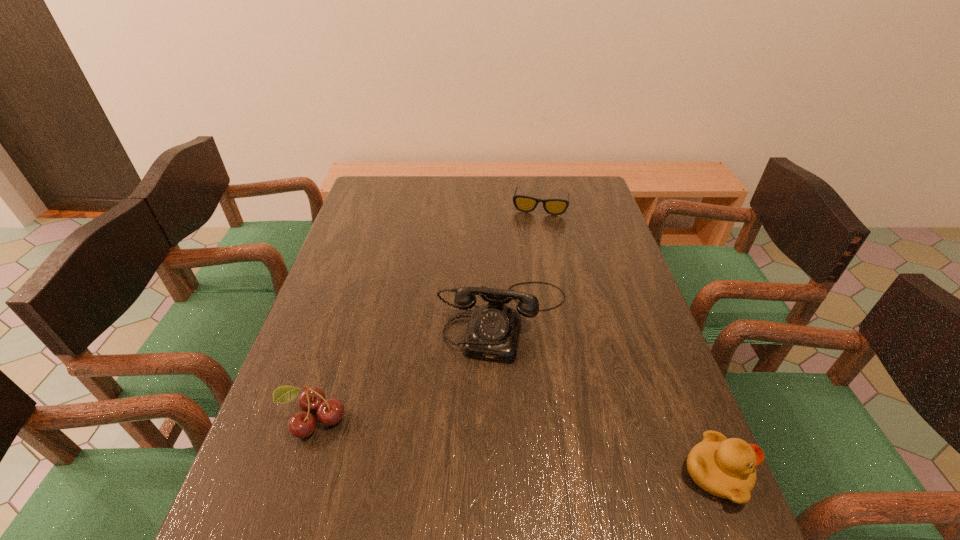
Find the location of a particular element. This screenshot has width=960, height=540. blank space at the near edge of the desktop is located at coordinates [x=501, y=463].

The width and height of the screenshot is (960, 540). What are the coordinates of `vacant area at the left edge` in the screenshot? It's located at (332, 340).

Find the location of `vacant point at the right edge`. vacant point at the right edge is located at coordinates (662, 411).

You are a GUI agent. You are given a task and a screenshot of the screen. Output one action in this format:
    pyautogui.click(x=<x>, y=<y>)
    Task: Click on the free space at the near left corner
    
    Given the screenshot: What is the action you would take?
    pyautogui.click(x=277, y=498)

Image resolution: width=960 pixels, height=540 pixels. I want to click on vacant area at the far right corner of the desktop, so click(x=586, y=192).

This screenshot has height=540, width=960. I want to click on vacant space that is in between the sunglasses and the leftmost object, so click(x=427, y=312).

Locate an element on the screen. blank region between the sunglasses and the cherry is located at coordinates (427, 312).

At what (x,y) coordinates should I click in order to perform the action: click on blank region between the shortest object and the telephone. Please return your answer as a coordinate pair (x, y). The height and width of the screenshot is (540, 960). Looking at the image, I should click on (522, 262).

In order to click on vacant space that is in between the farthest object and the telephone in this screenshot , I will do `click(522, 262)`.

Locate an element on the screen. The width and height of the screenshot is (960, 540). vacant space that is in between the telephone and the sunglasses is located at coordinates (522, 262).